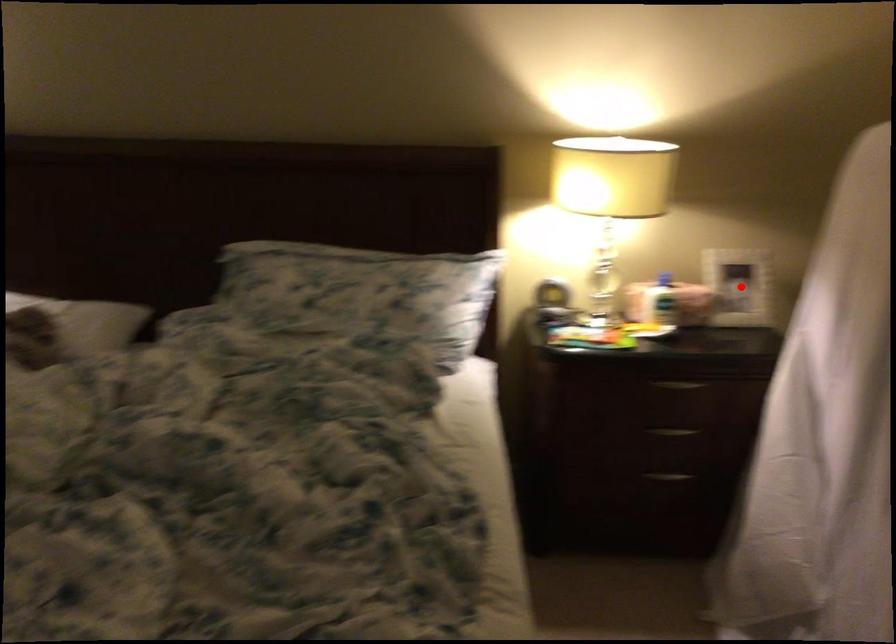
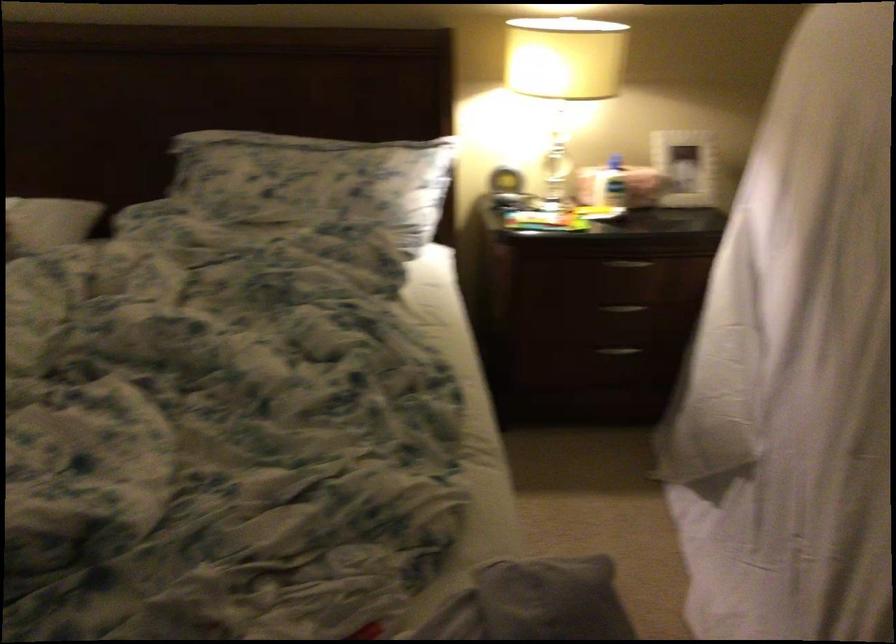
In the second image, find the point that corresponds to the highlighted location in the first image.

(684, 167)